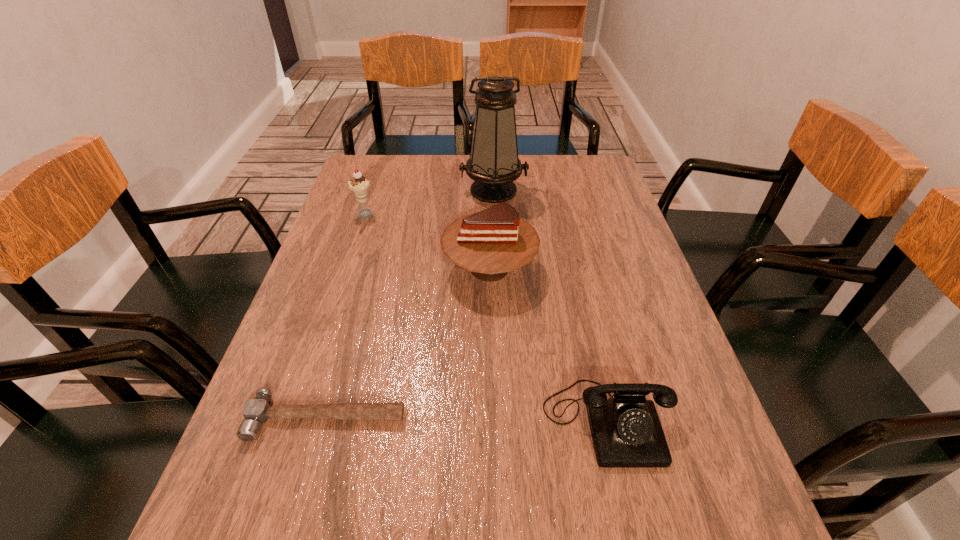
Select which object appears as the fourth closest to the icecream. Please provide its 2D coordinates. Your answer should be formatted as a tuple, i.e. [(x, y)], where the tuple contains the x and y coordinates of a point satisfying the conditions above.

[(626, 431)]

Choose which object is the nearest neighbor to the hammer. Please provide its 2D coordinates. Your answer should be formatted as a tuple, i.e. [(x, y)], where the tuple contains the x and y coordinates of a point satisfying the conditions above.

[(495, 241)]

At what (x,y) coordinates should I click in order to perform the action: click on vacant space that satisfies the following two spatial constraints: 1. on the back side of the fourth nearest object; 2. on the left side of the oil lamp. Please return your answer as a coordinate pair (x, y). The width and height of the screenshot is (960, 540). Looking at the image, I should click on (372, 190).